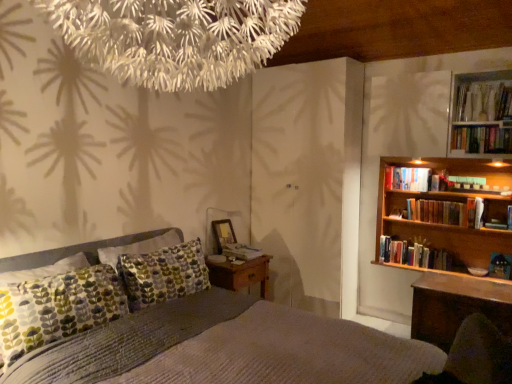
Locate an element on the screen. The image size is (512, 384). vacant point above hardcover books at upper right, the fifth book positioned from the left (from a real-world perspective) is located at coordinates (480, 129).